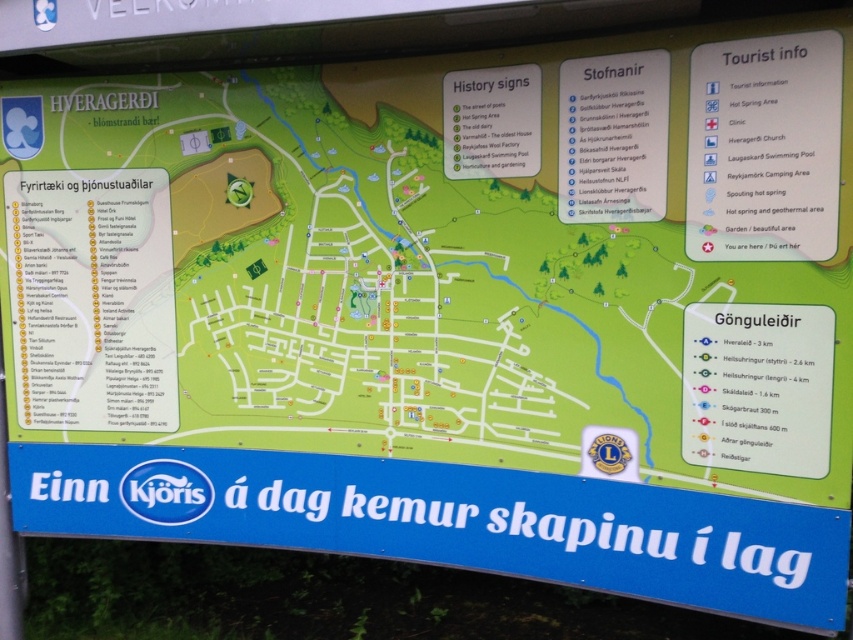
You are a tourist in Hveragerdi and want to visit the two points of interest located at coordinates point (759, 172) and point (641, 77). According to the map, which point is closer to the starting point at the town entrance?

Point (759, 172) is in front of point (641, 77), so it is closer to the starting point at the town entrance.

You are navigating a small delivery drone through Hveragerdi based on the map. Your route requires you to fly from the starting point to a destination. The starting point is at point (767, 188) and the destination is at point (519, 132). According to the map, will the drone have to fly over any landmarks or open spaces between these two points?

The point (767, 188) is in front of point (519, 132), so the drone will not have to fly over any landmarks or open spaces between these two points as they are aligned in a forward direction.